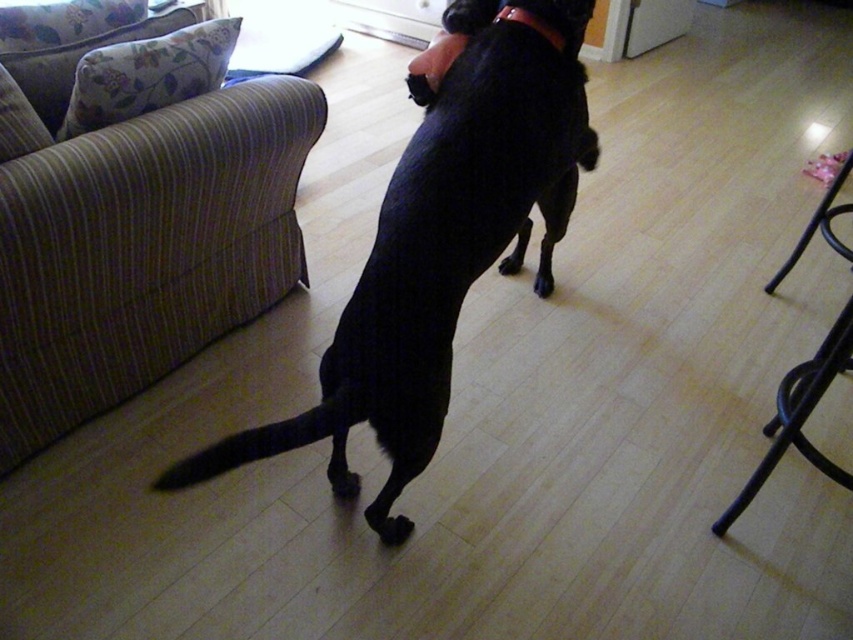
You are a dog trainer observing the scene. You need to decide whether the black smooth dog at center can comfortably rest its paws on the black metal stool at lower right. Based on their heights, what would you advise?

The black smooth dog at center is taller than the black metal stool at lower right, so it can comfortably rest its paws on the stool.

You are a dog trainer trying to teach the black dog to fetch. You have a rubber band at upper center and a black rubber paw at center. Which object is farther from the dog?

The rubber band at upper center is farther from the dog than the black rubber paw at center since the distance between them is 37.36 inches.

You are a delivery robot that needs to place a package between the black metal stool at lower right and the black fur paw at center. The package requires 1 meter of space. Can you fit the package there?

The distance between the black metal stool at lower right and the black fur paw at center is 95.34 centimeters, which is less than 1 meter. Therefore, the package cannot be placed there.